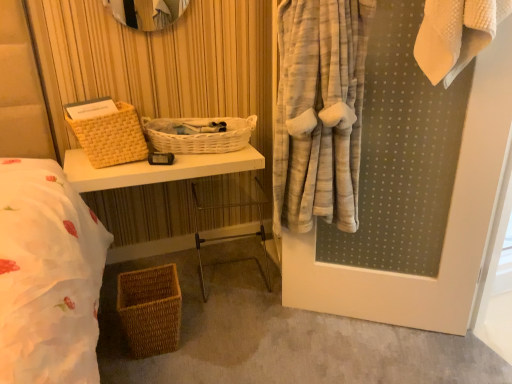
Find the location of a particular element. This screenshot has height=384, width=512. vacant region to the left of woven brown basket at lower left, which is counted as the third basket, starting from the top is located at coordinates (106, 338).